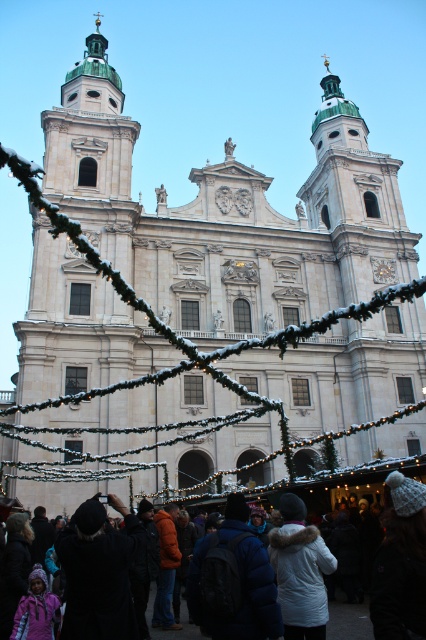
Between dark blue puffy jacket at center and black woolen hat at center, which one appears on the right side from the viewer's perspective?

dark blue puffy jacket at center

Does dark blue puffy jacket at center have a larger size compared to black woolen hat at center?

No.

Between point (235, 620) and point (62, 636), which one is positioned behind?

The point (62, 636) is behind.

Locate an element on the screen. This screenshot has width=426, height=640. dark blue puffy jacket at center is located at coordinates (233, 580).

Who is shorter, black woolen hat at center or white fur-trimmed coat at center?

Standing shorter between the two is black woolen hat at center.

Can you confirm if black woolen hat at center is bigger than white fur-trimmed coat at center?

Actually, black woolen hat at center might be smaller than white fur-trimmed coat at center.

What are the coordinates of `black woolen hat at center` in the screenshot? It's located at (98, 572).

Where is `black woolen hat at center`? This screenshot has width=426, height=640. black woolen hat at center is located at coordinates (98, 572).

Who is shorter, dark blue puffy jacket at center or white woolen hat at lower center?

dark blue puffy jacket at center

Is dark blue puffy jacket at center thinner than white woolen hat at lower center?

Yes.

Does point (227, 593) come closer to viewer compared to point (150, 604)?

Yes, it is in front of point (150, 604).

This screenshot has width=426, height=640. I want to click on dark blue puffy jacket at center, so click(233, 580).